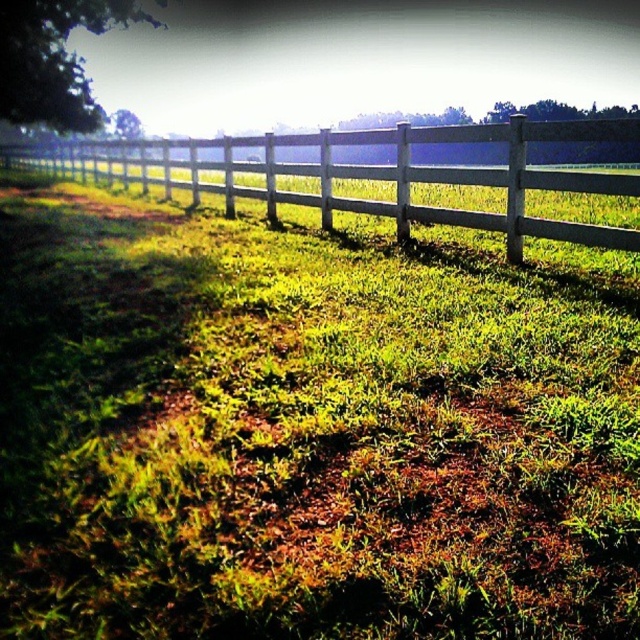
Is green grassy at center positioned in front of white wooden fence at upper center?

Yes, it is in front of white wooden fence at upper center.

Between green grassy at center and white wooden fence at upper center, which one appears on the left side from the viewer's perspective?

Positioned to the left is white wooden fence at upper center.

Between point (280, 506) and point (408, 180), which one is positioned behind?

The point (408, 180) is behind.

The width and height of the screenshot is (640, 640). I want to click on green grassy at center, so click(307, 429).